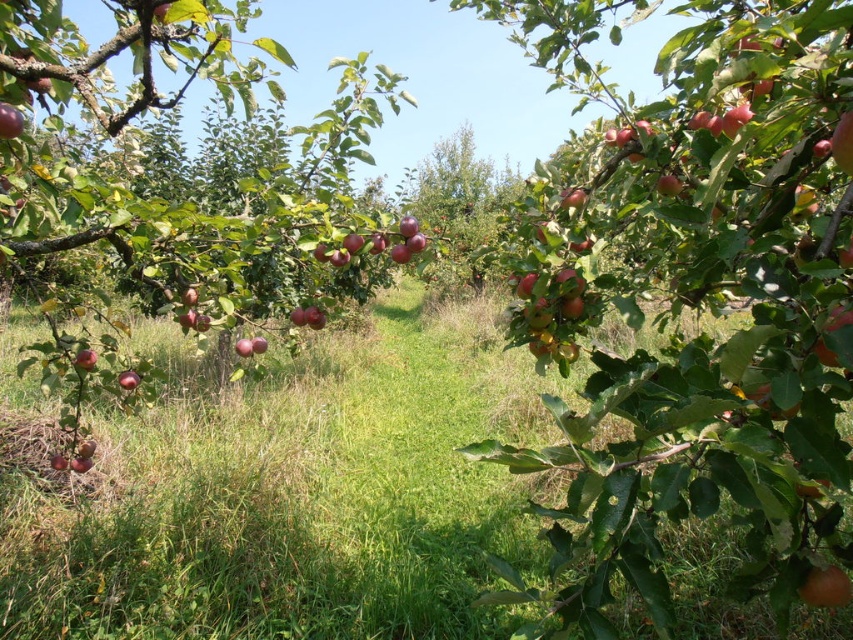
You are standing in the apple orchard and want to take a photo of both the point at coordinates (421,362) and the point at coordinates (814,593). Which point will appear closer to the camera in your photo?

The point at coordinates (421,362) will appear closer to the camera in the photo because it is further to the camera than the point at coordinates (814,593).

You are an apple picker standing at the lower left of the orchard. You see the shiny red apple at lower left and the glossy red apple at center. Which apple is taller?

The shiny red apple at lower left is taller than the glossy red apple at center.

You are an apple picker and you see two apples in the orchard. One is the shiny red apple at lower left and the other is the glossy red apple at center. Which apple has a smaller width?

The shiny red apple at lower left is thinner than the glossy red apple at center, so the shiny red apple at lower left has a smaller width.